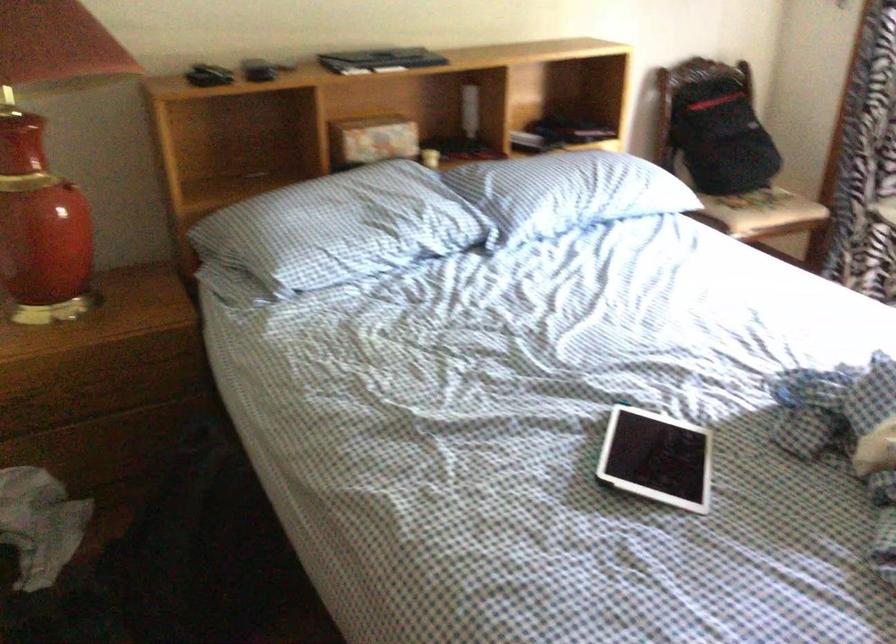
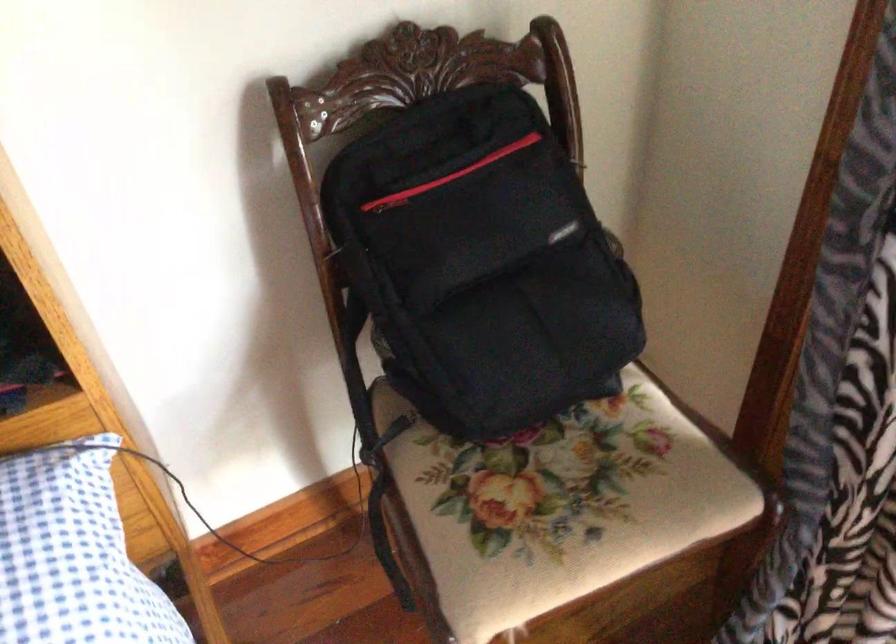
Find the pixel in the second image that matches point 738,114 in the first image.

(480, 263)